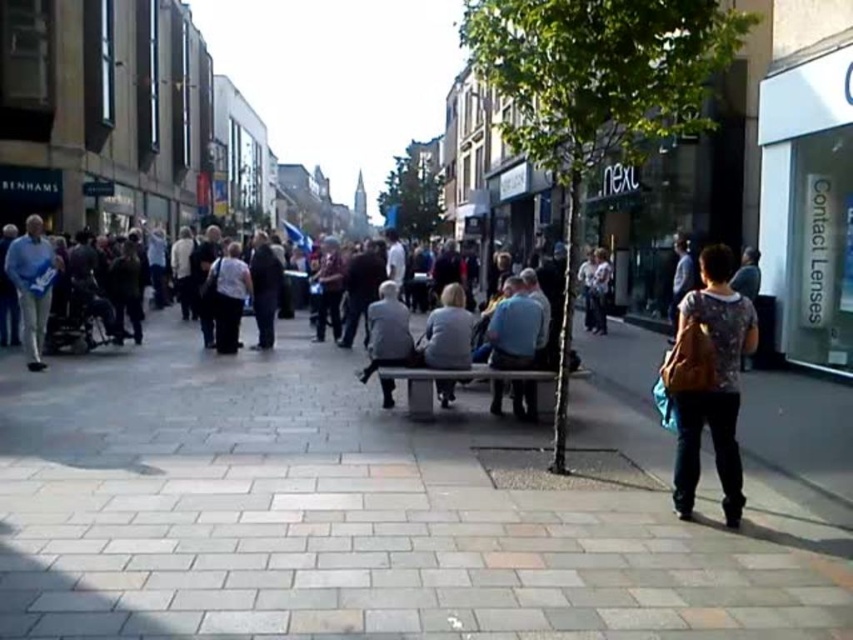
Question: From the image, what is the correct spatial relationship of light gray fabric jacket at center in relation to gray fabric jacket at center?

Choices:
 (A) left
 (B) right

Answer: (B)

Question: Considering the real-world distances, which object is farthest from the gray concrete pavement at center?

Choices:
 (A) gray fabric jacket at center
 (B) dark gray concrete crowd at center

Answer: (B)

Question: Which of the following is the farthest from the observer?

Choices:
 (A) (737, 474)
 (B) (511, 580)
 (C) (454, 296)
 (D) (500, 353)

Answer: (C)

Question: Which of the following is the farthest from the observer?

Choices:
 (A) (431, 349)
 (B) (224, 307)
 (C) (520, 348)
 (D) (439, 401)

Answer: (B)

Question: Can you confirm if gray concrete pavement at center is positioned to the left of patterned fabric shirt at right?

Choices:
 (A) yes
 (B) no

Answer: (A)

Question: Is gray concrete pavement at center further to the viewer compared to light gray fabric jacket at center?

Choices:
 (A) yes
 (B) no

Answer: (B)